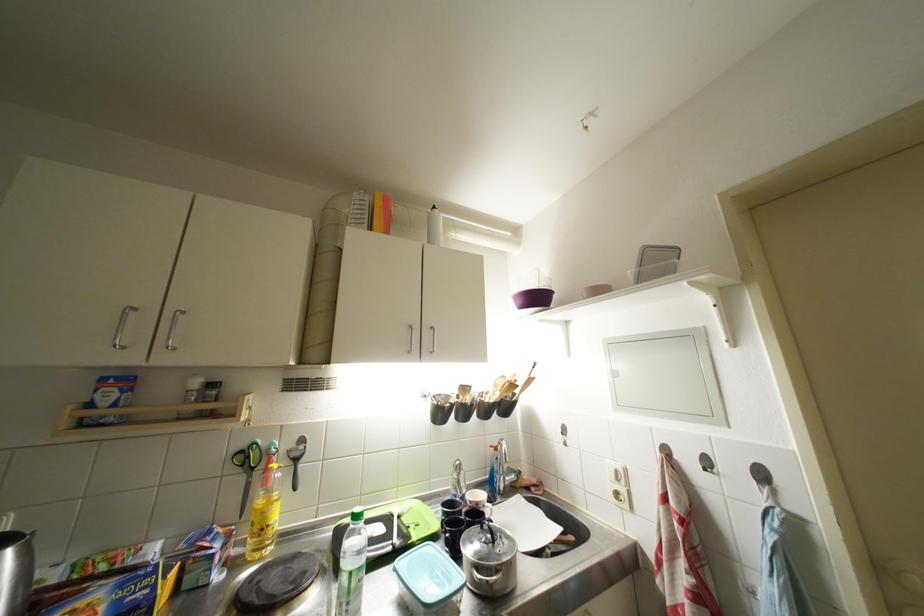
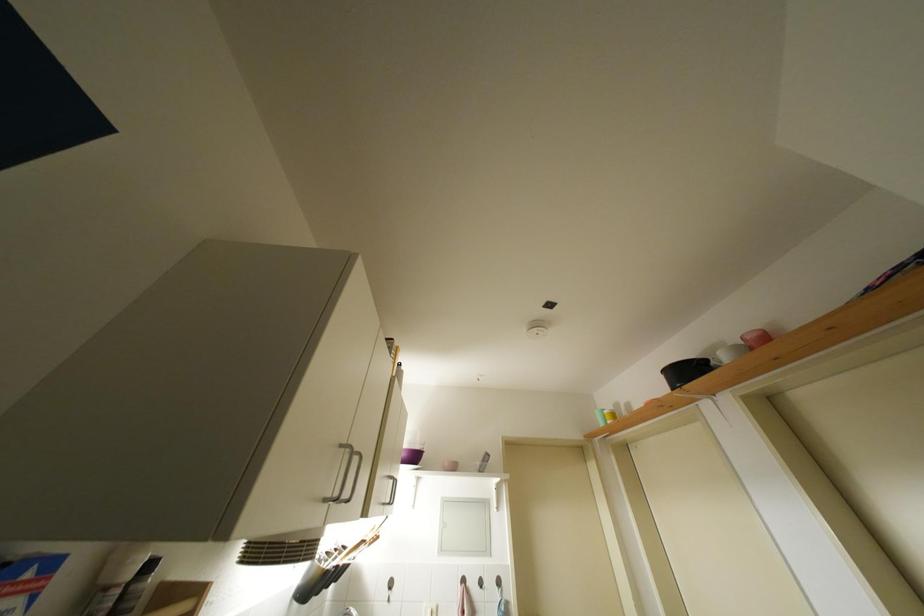
Where in the second image is the point corresponding to point 527,306 from the first image?

(410, 459)